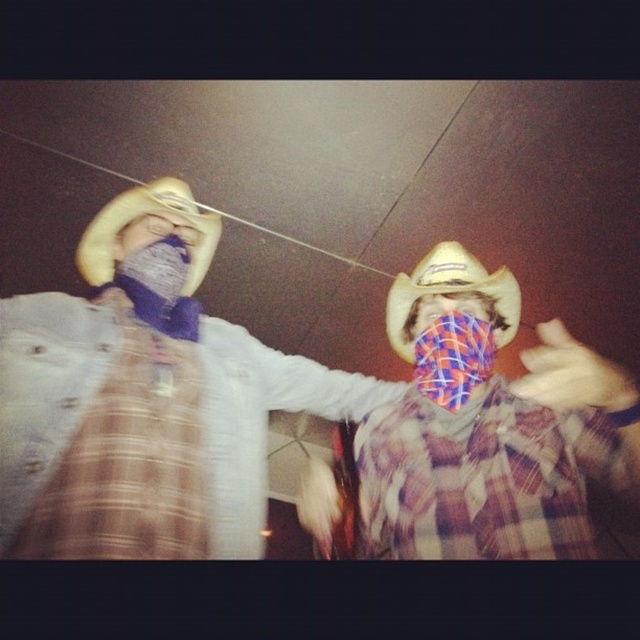
The image size is (640, 640). I want to click on light brown leather cowboy hat at left, so click(x=141, y=216).

Can you confirm if light brown leather cowboy hat at left is taller than light brown felt cowboy hat at center?

No.

This screenshot has height=640, width=640. Describe the element at coordinates (141, 216) in the screenshot. I see `light brown leather cowboy hat at left` at that location.

The height and width of the screenshot is (640, 640). Find the location of `light brown leather cowboy hat at left`. light brown leather cowboy hat at left is located at coordinates (141, 216).